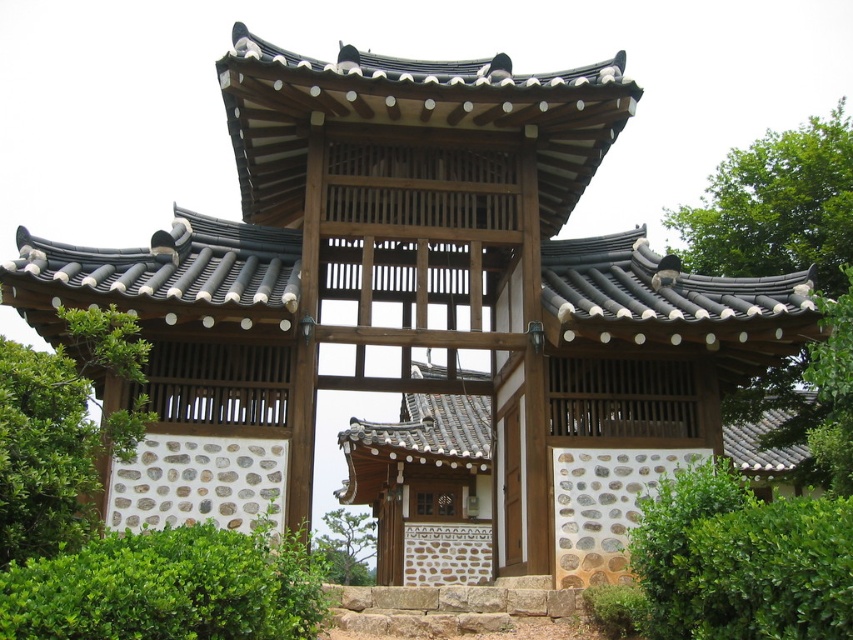
Can you confirm if green leafy bush at lower left is positioned below green leafy tree at left?

Yes.

Between green leafy bush at lower left and green leafy tree at left, which one appears on the right side from the viewer's perspective?

green leafy bush at lower left is more to the right.

At what (x,y) coordinates should I click in order to perform the action: click on green leafy bush at lower left. Please return your answer as a coordinate pair (x, y). Looking at the image, I should click on (167, 588).

How far apart are green leafy bush at lower left and green leafy tree at upper right?

A distance of 32.12 meters exists between green leafy bush at lower left and green leafy tree at upper right.

Is point (199, 554) positioned before point (822, 243)?

Yes, point (199, 554) is in front of point (822, 243).

Locate an element on the screen. This screenshot has width=853, height=640. green leafy bush at lower left is located at coordinates (167, 588).

Is green leafy bush at lower right to the right of green leafy bush at lower left from the viewer's perspective?

Indeed, green leafy bush at lower right is positioned on the right side of green leafy bush at lower left.

Can you confirm if green leafy bush at lower right is positioned below green leafy bush at lower left?

Actually, green leafy bush at lower right is above green leafy bush at lower left.

The image size is (853, 640). What do you see at coordinates (740, 561) in the screenshot?
I see `green leafy bush at lower right` at bounding box center [740, 561].

I want to click on green leafy bush at lower right, so click(740, 561).